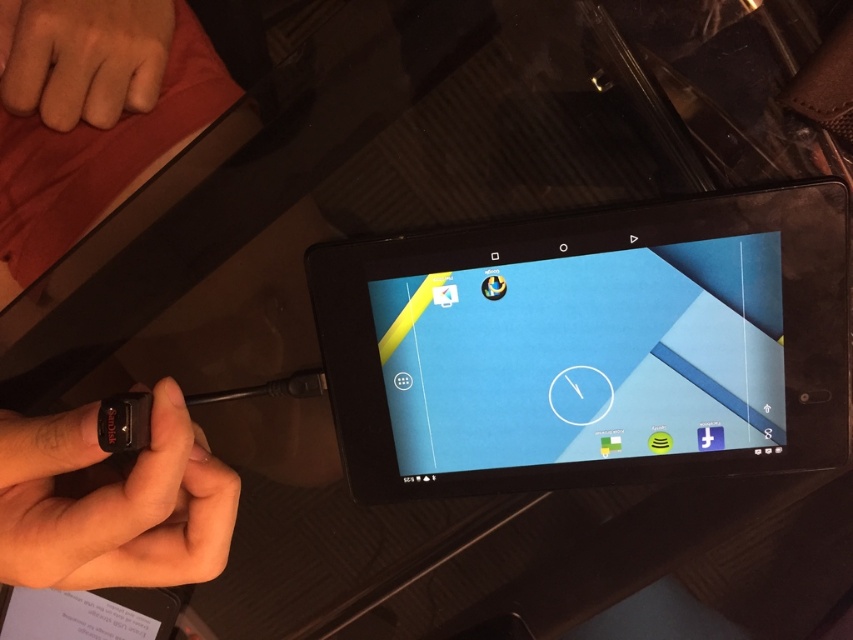
Between black plastic tablet at center and black matte usb cable at lower left, which one has less height?

Standing shorter between the two is black matte usb cable at lower left.

Who is higher up, black plastic tablet at center or black matte usb cable at lower left?

Positioned higher is black plastic tablet at center.

The width and height of the screenshot is (853, 640). What do you see at coordinates (590, 346) in the screenshot?
I see `black plastic tablet at center` at bounding box center [590, 346].

Locate an element on the screen. The image size is (853, 640). black plastic tablet at center is located at coordinates (590, 346).

Which is above, black plastic tablet at center or skinny flesh at upper left?

skinny flesh at upper left

Is black plastic tablet at center to the right of skinny flesh at upper left from the viewer's perspective?

Indeed, black plastic tablet at center is positioned on the right side of skinny flesh at upper left.

Which is behind, point (746, 428) or point (73, 19)?

The point (746, 428) is more distant.

Where is `black plastic tablet at center`? black plastic tablet at center is located at coordinates (590, 346).

Does black matte usb cable at lower left have a smaller size compared to skinny flesh at upper left?

No.

Does black matte usb cable at lower left have a larger size compared to skinny flesh at upper left?

Yes.

Is point (67, 436) less distant than point (16, 109)?

That is True.

The image size is (853, 640). I want to click on black matte usb cable at lower left, so click(112, 502).